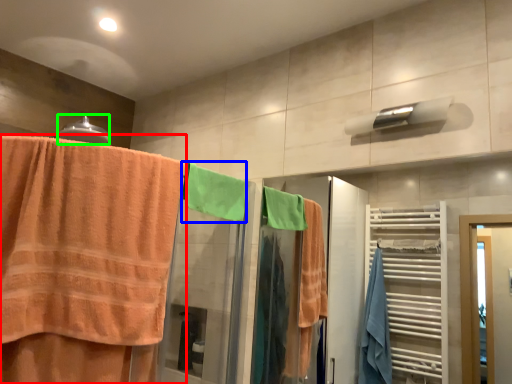
Question: Which is farther away from towel (highlighted by a red box)? beach towel (highlighted by a blue box) or towel bar (highlighted by a green box)?

Choices:
 (A) beach towel
 (B) towel bar

Answer: (B)